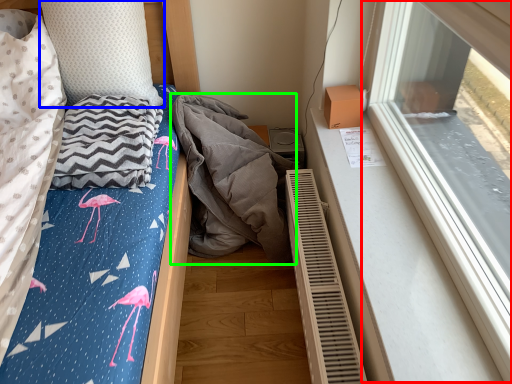
Question: Considering the real-world distances, which object is closest to window (highlighted by a red box)? pillow (highlighted by a blue box) or material (highlighted by a green box).

Choices:
 (A) pillow
 (B) material

Answer: (B)